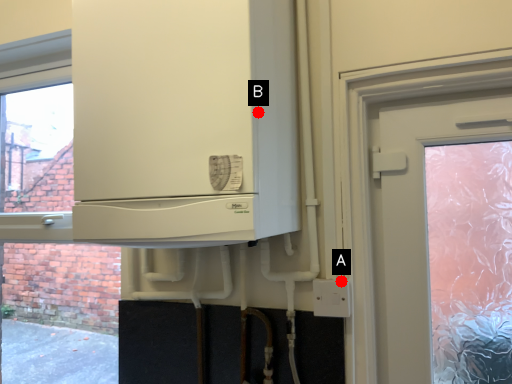
Question: Two points are circled on the image, labeled by A and B beside each circle. Which point appears farthest from the camera in this image?

Choices:
 (A) A is further
 (B) B is further

Answer: (A)